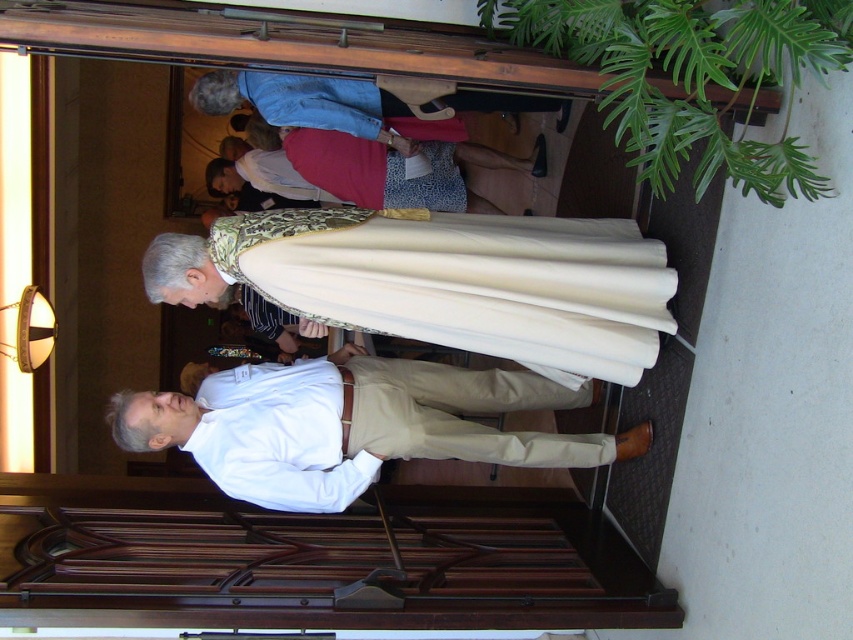
Question: Which of the following is the farthest from the observer?

Choices:
 (A) (374, 371)
 (B) (437, 148)
 (C) (521, 228)

Answer: (B)

Question: Estimate the real-world distances between objects in this image. Which object is closer to the khaki pants at center?

Choices:
 (A) white cotton shirt at center
 (B) matte gold robe at center

Answer: (A)

Question: Which of the following is the closest to the observer?

Choices:
 (A) (169, 413)
 (B) (345, 147)

Answer: (A)

Question: Where is khaki pants at center located in relation to matte gold robe at center in the image?

Choices:
 (A) right
 (B) left

Answer: (A)

Question: Does white cotton shirt at center lie in front of matte gold robe at center?

Choices:
 (A) no
 (B) yes

Answer: (B)

Question: Does khaki pants at center appear over matte gold robe at center?

Choices:
 (A) yes
 (B) no

Answer: (B)